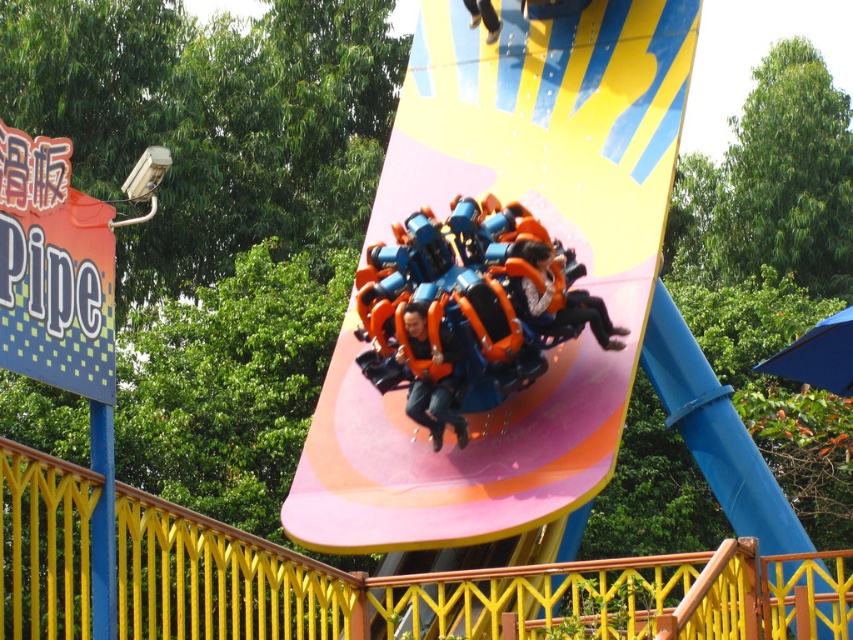
Question: Among these objects, which one is farthest from the camera?

Choices:
 (A) orange matte roller coaster car at center
 (B) matte orange helmet at center
 (C) orange fabric seat at center

Answer: (B)

Question: Considering the relative positions of orange matte roller coaster car at center and matte orange helmet at center in the image provided, where is orange matte roller coaster car at center located with respect to matte orange helmet at center?

Choices:
 (A) above
 (B) below

Answer: (B)

Question: Which point appears closest to the camera in this image?

Choices:
 (A) (444, 406)
 (B) (524, 243)
 (C) (364, 404)

Answer: (B)

Question: Can you confirm if orange matte slide at center is thinner than orange matte roller coaster car at center?

Choices:
 (A) no
 (B) yes

Answer: (A)

Question: Can you confirm if orange fabric seat at center is positioned above matte orange helmet at center?

Choices:
 (A) yes
 (B) no

Answer: (B)

Question: Which point appears farthest from the camera in this image?

Choices:
 (A) (426, 529)
 (B) (587, 310)

Answer: (B)